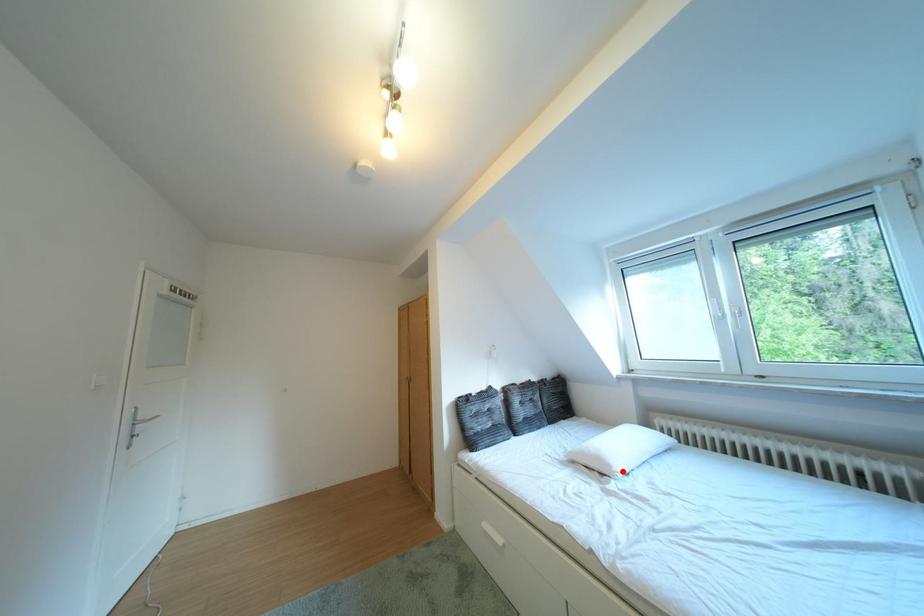
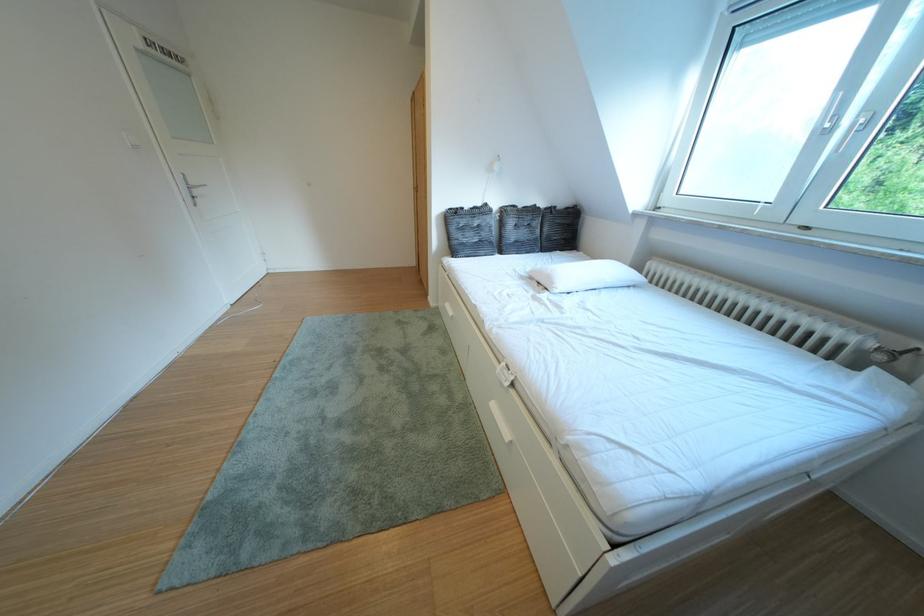
Where in the second image is the point corresponding to the highlighted location from the first image?

(565, 288)